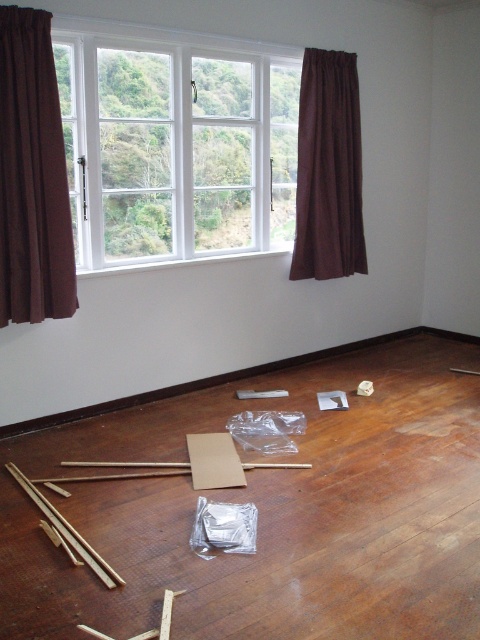
Question: Which is farther from the brown velvet curtain at left?

Choices:
 (A) brown fabric curtain at right
 (B) brown wood floor at center

Answer: (A)

Question: Is white glass window at upper center smaller than brown fabric curtain at right?

Choices:
 (A) yes
 (B) no

Answer: (B)

Question: Which point appears closest to the camera in this image?

Choices:
 (A) (385, 566)
 (B) (72, 193)
 (C) (319, 108)

Answer: (A)

Question: Which object is closer to the camera taking this photo?

Choices:
 (A) brown wood floor at center
 (B) brown velvet curtain at left

Answer: (A)

Question: Does brown velvet curtain at left come in front of brown fabric curtain at right?

Choices:
 (A) yes
 (B) no

Answer: (A)

Question: Is white glass window at upper center smaller than brown fabric curtain at right?

Choices:
 (A) no
 (B) yes

Answer: (A)